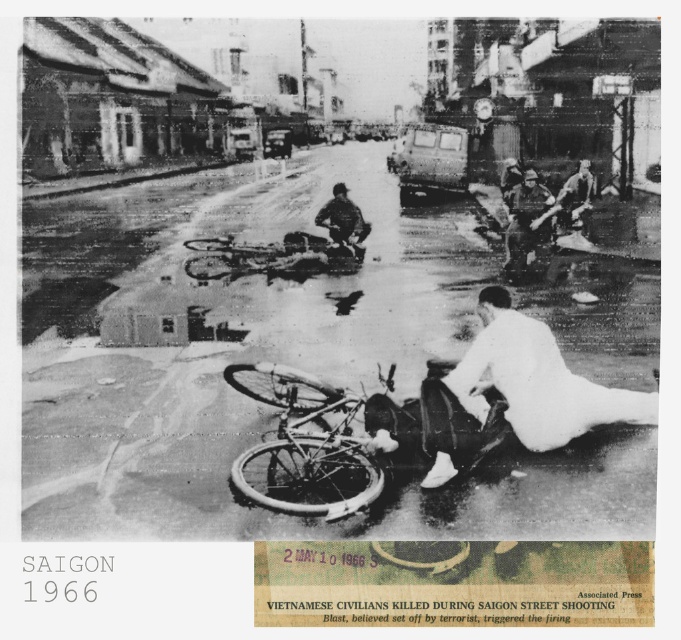
You are a journalist at the scene of the incident. You see two uniforms in the center of the image, a camouflage fabric uniform at center and a dark gray uniform at center. Which one is positioned to the right of the other?

The camouflage fabric uniform at center is to the right of dark gray uniform at center.

You are a photographer analyzing the scene. You notice the white matte bicycle at center and the white matte shirt at lower right. Which object appears taller in the photograph?

The white matte shirt at lower right appears taller than the white matte bicycle at center in the photograph.